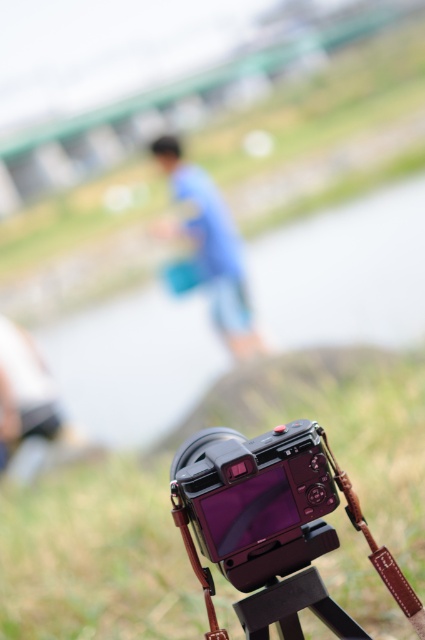
Question: Which object appears closest to the camera in this image?

Choices:
 (A) blue fabric person at center
 (B) black rubber tripod at lower center

Answer: (B)

Question: Is green grass at lower center smaller than satin black camera at center?

Choices:
 (A) yes
 (B) no

Answer: (B)

Question: Can you confirm if satin black camera at center is bigger than blue fabric person at center?

Choices:
 (A) no
 (B) yes

Answer: (A)

Question: Which object is closer to the camera taking this photo?

Choices:
 (A) blue fabric person at center
 (B) satin black camera at center
 (C) green grass at lower center
 (D) black rubber tripod at lower center

Answer: (B)

Question: Is green grass at lower center below satin black camera at center?

Choices:
 (A) no
 (B) yes

Answer: (B)

Question: Which point is farther to the camera?

Choices:
 (A) black rubber tripod at lower center
 (B) blue fabric person at center

Answer: (B)